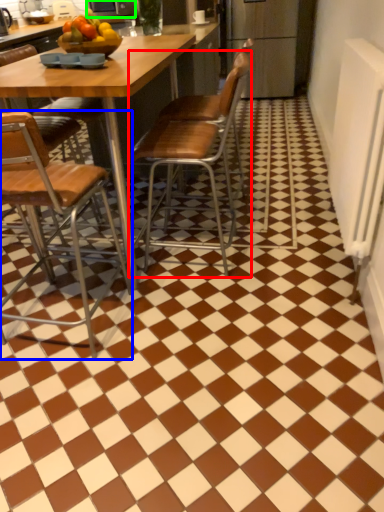
Question: Based on their relative distances, which object is nearer to chair (highlighted by a red box)? Choose from chair (highlighted by a blue box) and appliance (highlighted by a green box).

Choices:
 (A) chair
 (B) appliance

Answer: (A)